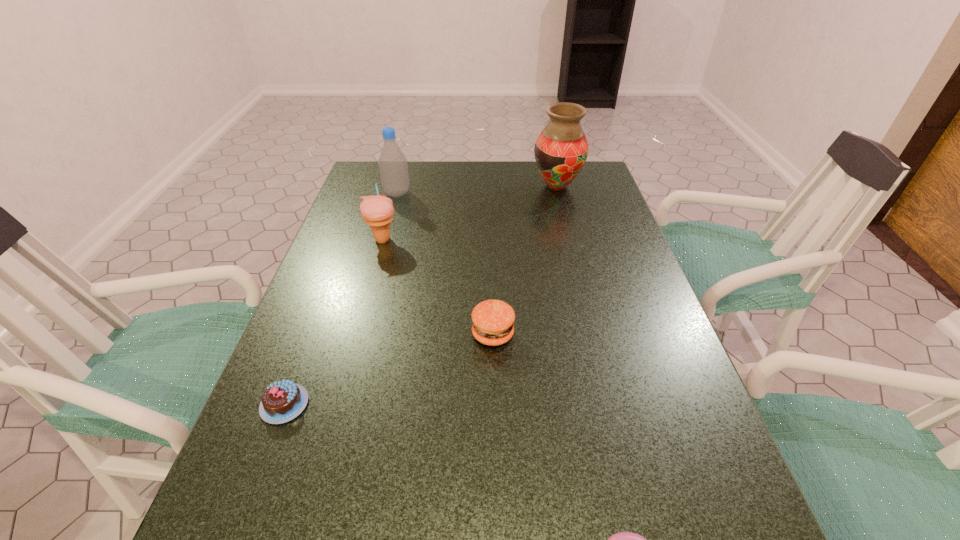
Choose which object is the fourth nearest neighbor to the bottle. Please provide its 2D coordinates. Your answer should be formatted as a tuple, i.e. [(x, y)], where the tuple contains the x and y coordinates of a point satisfying the conditions above.

[(282, 401)]

Identify which object is the nearest to the bottle. Please provide its 2D coordinates. Your answer should be formatted as a tuple, i.e. [(x, y)], where the tuple contains the x and y coordinates of a point satisfying the conditions above.

[(377, 211)]

In order to click on blank area in the image that satisfies the following two spatial constraints: 1. on the back side of the third tallest object; 2. on the left side of the vase in this screenshot , I will do `click(397, 186)`.